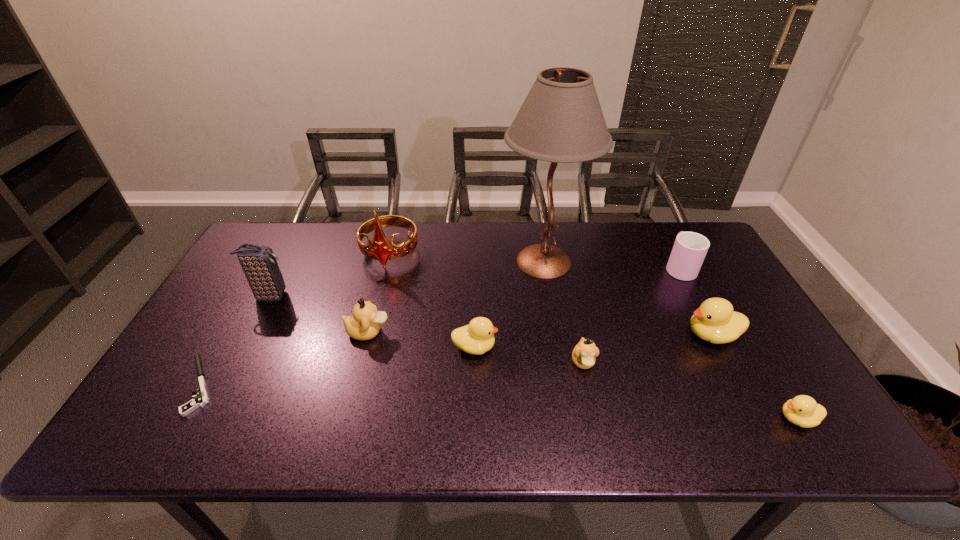
The width and height of the screenshot is (960, 540). Find the location of `cup that is positioned at the right edge`. cup that is positioned at the right edge is located at coordinates (690, 248).

Identify the location of object at the near left corner. This screenshot has height=540, width=960. (201, 400).

Find the location of a particular element. The height and width of the screenshot is (540, 960). object at the far right corner is located at coordinates (690, 248).

Where is `object at the near right corner`? The image size is (960, 540). object at the near right corner is located at coordinates (802, 410).

This screenshot has width=960, height=540. In the image, there is a desktop. Find the location of `vacant region at the far edge`. vacant region at the far edge is located at coordinates (600, 253).

Image resolution: width=960 pixels, height=540 pixels. In the image, there is a desktop. Identify the location of free space at the near edge. (392, 414).

Locate an element on the screen. The image size is (960, 540). blank space at the left edge of the desktop is located at coordinates (251, 310).

The height and width of the screenshot is (540, 960). In the image, there is a desktop. In order to click on vacant region at the right edge in this screenshot , I will do `click(778, 352)`.

The height and width of the screenshot is (540, 960). In order to click on free spot at the far right corner of the desktop in this screenshot , I will do `click(666, 245)`.

Where is `free spot between the nearest duckling and the second biggest yellow duckling`? Image resolution: width=960 pixels, height=540 pixels. free spot between the nearest duckling and the second biggest yellow duckling is located at coordinates (636, 383).